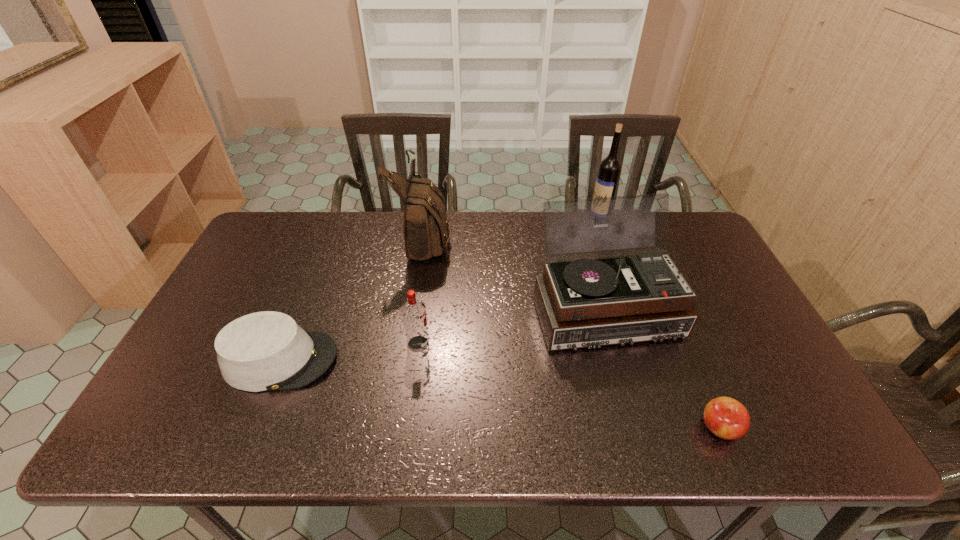
Identify the location of free spot that satisfies the following two spatial constraints: 1. on the front-facing side of the shoulder bag; 2. on the back side of the shortest object. This screenshot has width=960, height=540. [x=396, y=428].

The image size is (960, 540). I want to click on vacant position in the image that satisfies the following two spatial constraints: 1. on the front-facing side of the shortest object; 2. on the left side of the shoulder bag, so click(396, 428).